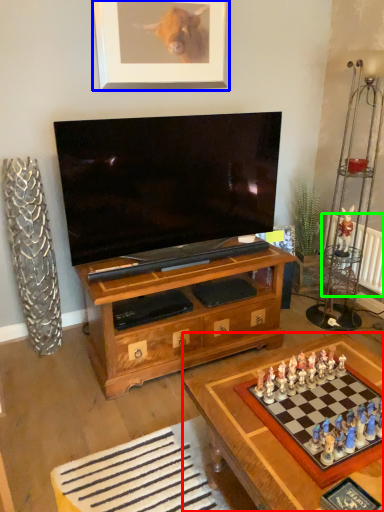
Question: Considering the real-world distances, which object is farthest from table (highlighted by a red box)? picture frame (highlighted by a blue box) or radiator (highlighted by a green box)?

Choices:
 (A) picture frame
 (B) radiator

Answer: (A)